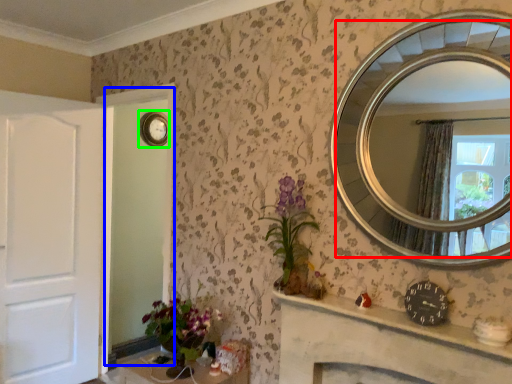
Question: Based on their relative distances, which object is nearer to mirror (highlighted by a red box)? Choose from glass door (highlighted by a blue box) and clock (highlighted by a green box).

Choices:
 (A) glass door
 (B) clock

Answer: (B)